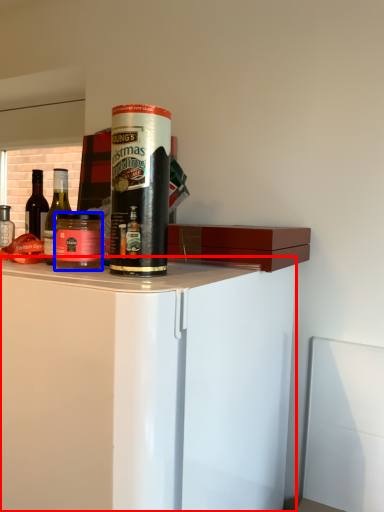
Question: Which object is further to the camera taking this photo, cabinetry (highlighted by a red box) or beverage (highlighted by a blue box)?

Choices:
 (A) cabinetry
 (B) beverage

Answer: (B)